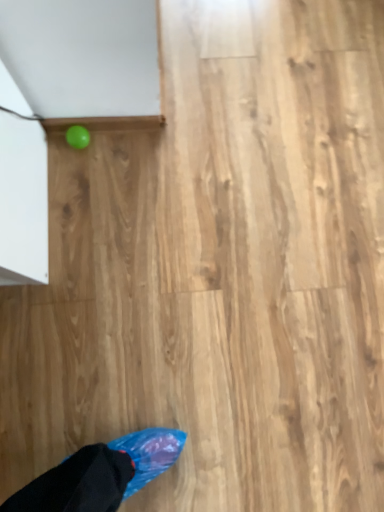
This screenshot has width=384, height=512. I want to click on free space in front of green rubber ball at upper left, so click(x=72, y=192).